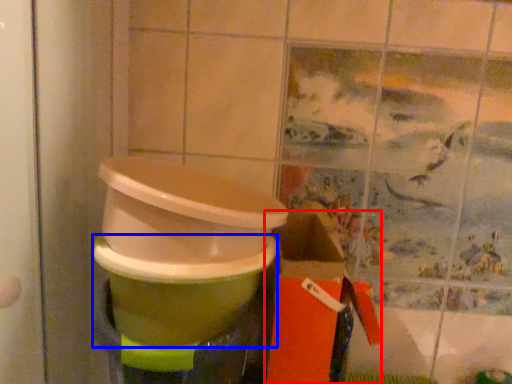
Question: Which object is further to the camera taking this photo, box (highlighted by a red box) or toilet bowl (highlighted by a blue box)?

Choices:
 (A) box
 (B) toilet bowl

Answer: (A)